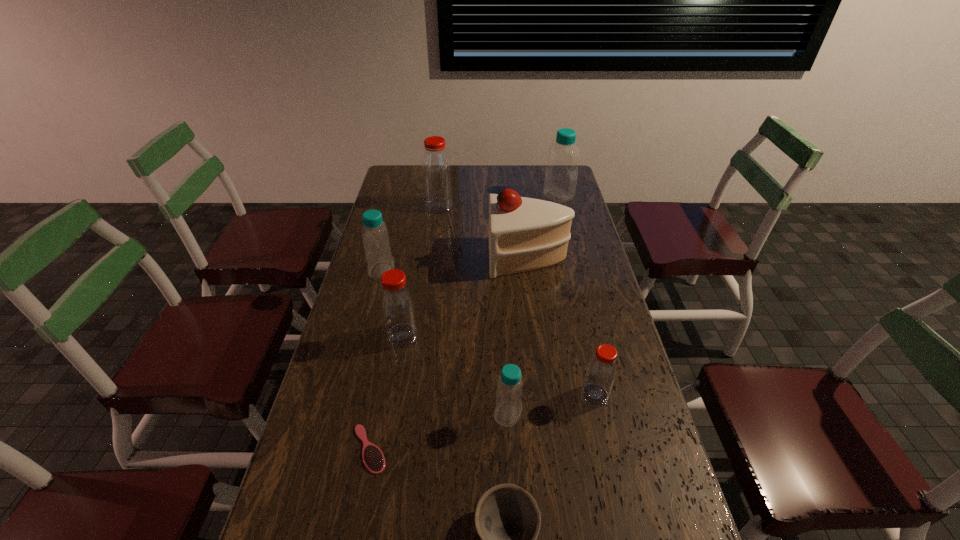
The image size is (960, 540). I want to click on the biggest blue bottle, so click(x=561, y=174).

At what (x,y) coordinates should I click in order to perform the action: click on the rightmost blue bottle. Please return your answer as a coordinate pair (x, y). The image size is (960, 540). Looking at the image, I should click on (561, 174).

Where is `the farthest red bottle`? the farthest red bottle is located at coordinates (436, 167).

Identify the location of cake. The width and height of the screenshot is (960, 540). (525, 234).

Identify the location of the leftmost blue bottle. (375, 235).

Find the location of a particular element. the second nearest blue bottle is located at coordinates (375, 235).

This screenshot has height=540, width=960. Find the location of `the second nearest red bottle`. the second nearest red bottle is located at coordinates (397, 304).

At what (x,y) coordinates should I click in order to perform the action: click on the second smallest red bottle. Please return your answer as a coordinate pair (x, y). The height and width of the screenshot is (540, 960). Looking at the image, I should click on (397, 304).

Locate an element on the screen. the nearest red bottle is located at coordinates (601, 371).

Image resolution: width=960 pixels, height=540 pixels. In order to click on the rightmost red bottle in this screenshot , I will do `click(601, 371)`.